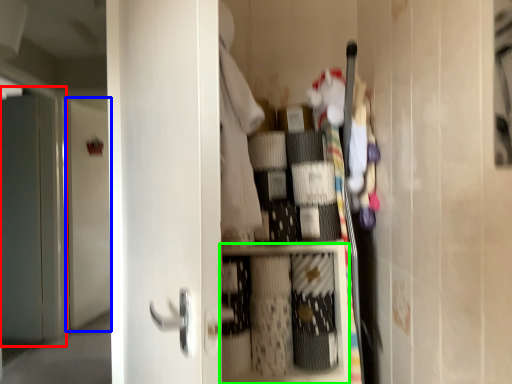
Question: Which is farther away from screen door (highlighted by a red box)? door (highlighted by a blue box) or cabinet (highlighted by a green box)?

Choices:
 (A) door
 (B) cabinet

Answer: (B)